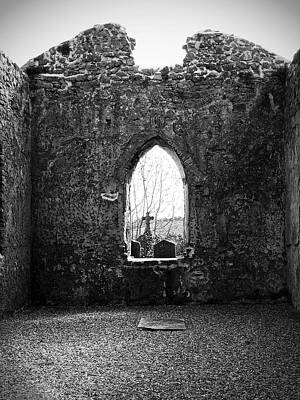
Where is `window arch`? This screenshot has height=400, width=300. window arch is located at coordinates (154, 181).